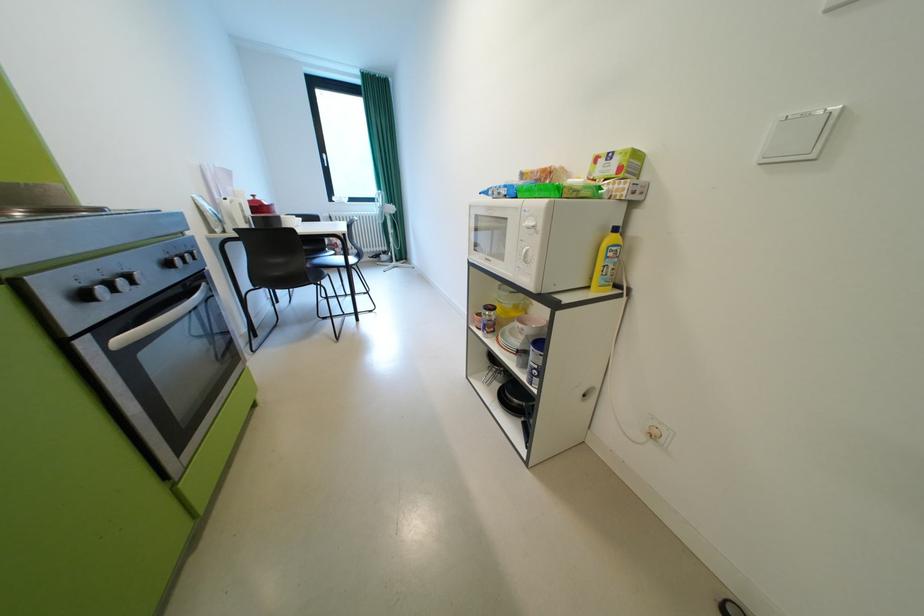
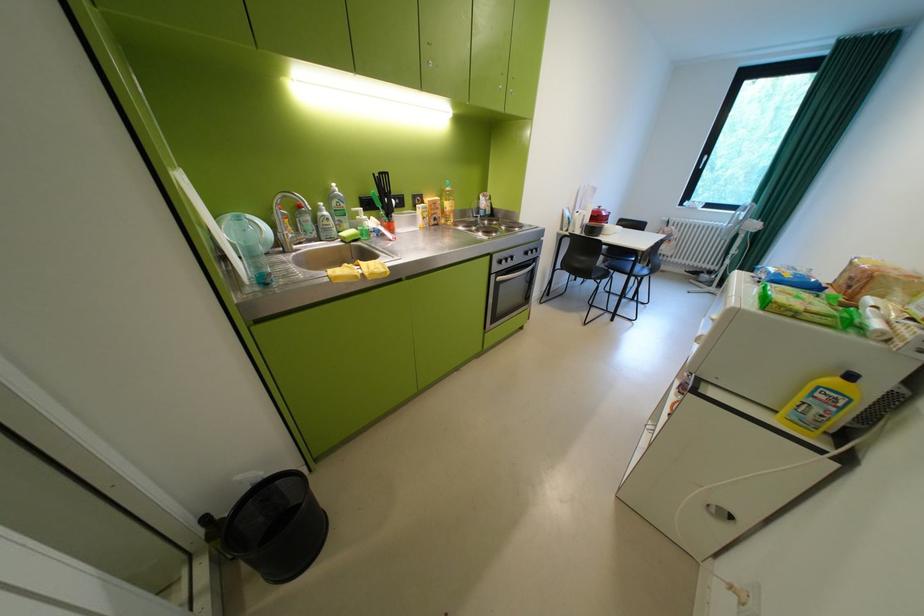
In the second image, find the point that corresponds to (x=178, y=265) in the first image.

(537, 254)